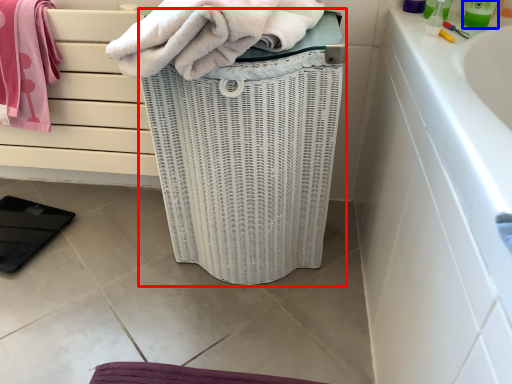
Question: Which point is further to the camera, basket container (highlighted by a red box) or cleaning product (highlighted by a blue box)?

Choices:
 (A) basket container
 (B) cleaning product

Answer: (B)